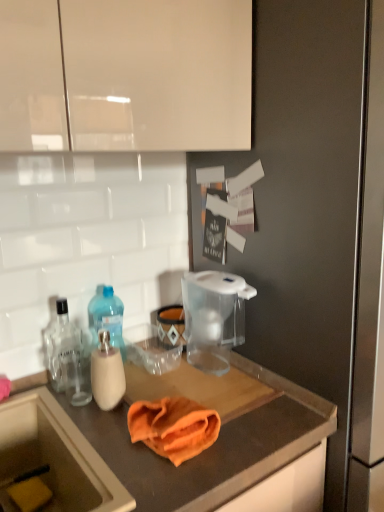
This screenshot has height=512, width=384. Find the location of `free space in front of translucent plastic bottle at left, which is the second bottle in left-to-right order`. free space in front of translucent plastic bottle at left, which is the second bottle in left-to-right order is located at coordinates (125, 391).